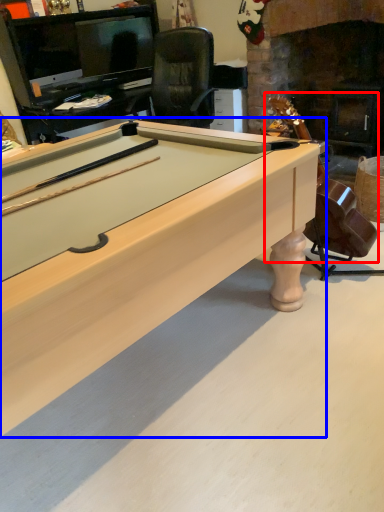
Question: Which object appears closest to the camera in this image, guitar (highlighted by a red box) or billiard table (highlighted by a blue box)?

Choices:
 (A) guitar
 (B) billiard table

Answer: (B)